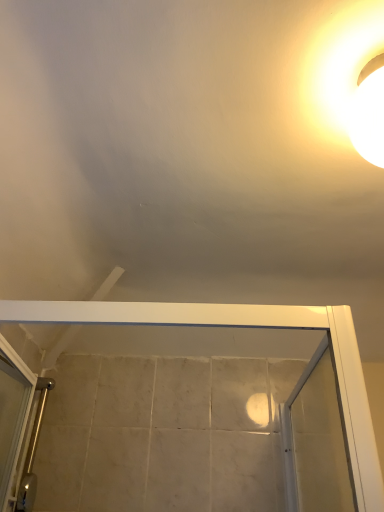
Question: Should I look upward or downward to see white glossy light fixture at upper right?

Choices:
 (A) down
 (B) up

Answer: (B)